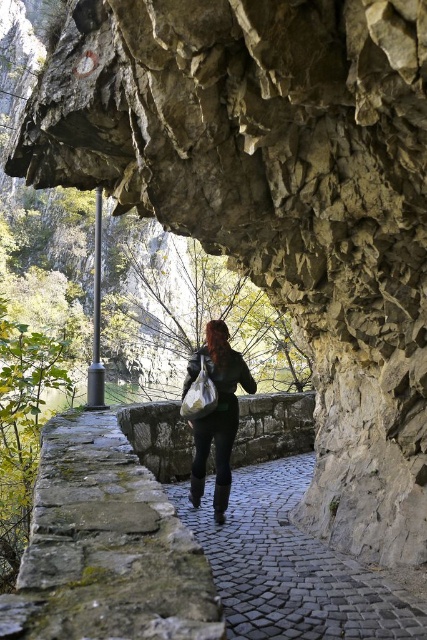
Question: Considering the real-world distances, which object is closest to the matte white plastic bag at center?

Choices:
 (A) matte black jacket at center
 (B) black cobblestone path at center

Answer: (A)

Question: Based on their relative distances, which object is farther from the matte black jacket at center?

Choices:
 (A) matte white plastic bag at center
 (B) black cobblestone path at center

Answer: (B)

Question: Does black cobblestone path at center appear on the right side of matte white plastic bag at center?

Choices:
 (A) yes
 (B) no

Answer: (A)

Question: Is black cobblestone path at center positioned before matte black jacket at center?

Choices:
 (A) no
 (B) yes

Answer: (B)

Question: Which object is positioned closest to the matte black jacket at center?

Choices:
 (A) matte white plastic bag at center
 (B) black cobblestone path at center

Answer: (A)

Question: Does black cobblestone path at center lie behind matte black jacket at center?

Choices:
 (A) yes
 (B) no

Answer: (B)